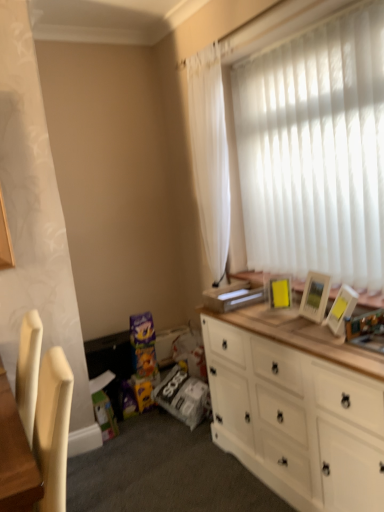
Find the location of `free space above white wood cabinet at right (from a real-world perspective)`. free space above white wood cabinet at right (from a real-world perspective) is located at coordinates pos(303,327).